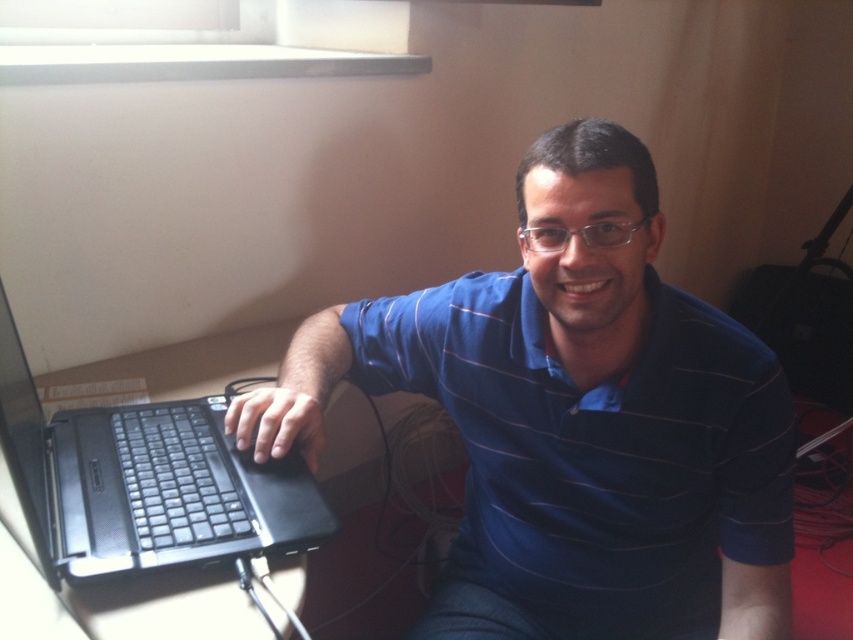
In the scene shown: Where is the blue striped shirt at center located in the image?

The blue striped shirt at center is located at the coordinates point [576,420].

You are a photographer setting up a shot of the man and his laptop. The blue striped shirt at center and the black matte laptop at lower left are both in the frame. Which object appears larger in the photo?

The blue striped shirt at center appears larger in the photo because it is much taller than the black matte laptop at lower left.

You are a photographer taking a picture of the man in the scene. To ensure both the blue striped shirt at center and the black matte laptop at lower left are clearly visible in the photo, where should you position the camera relative to the man?

The black matte laptop at lower left is behind the blue striped shirt at center, so positioning the camera slightly to the side of the man would allow both objects to be visible without one blocking the other.